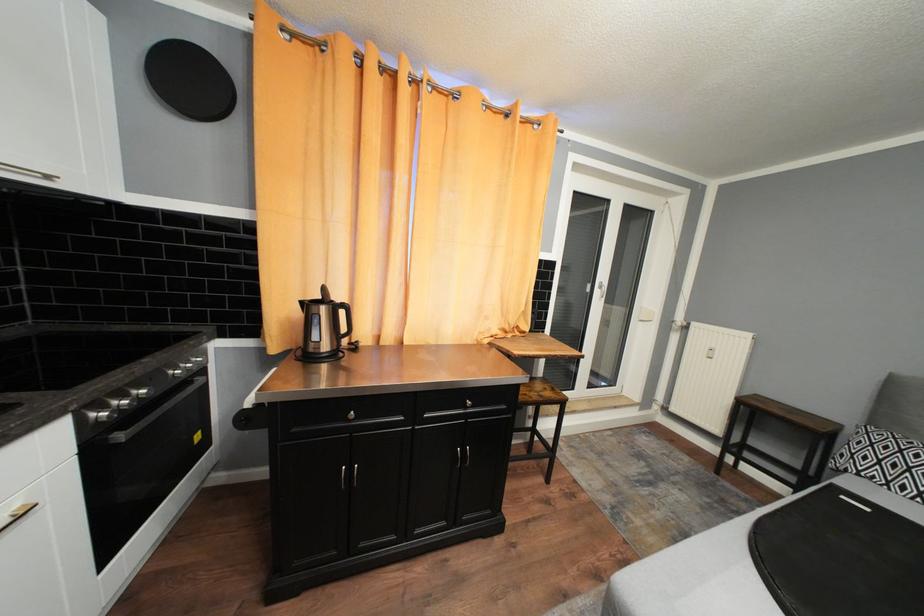
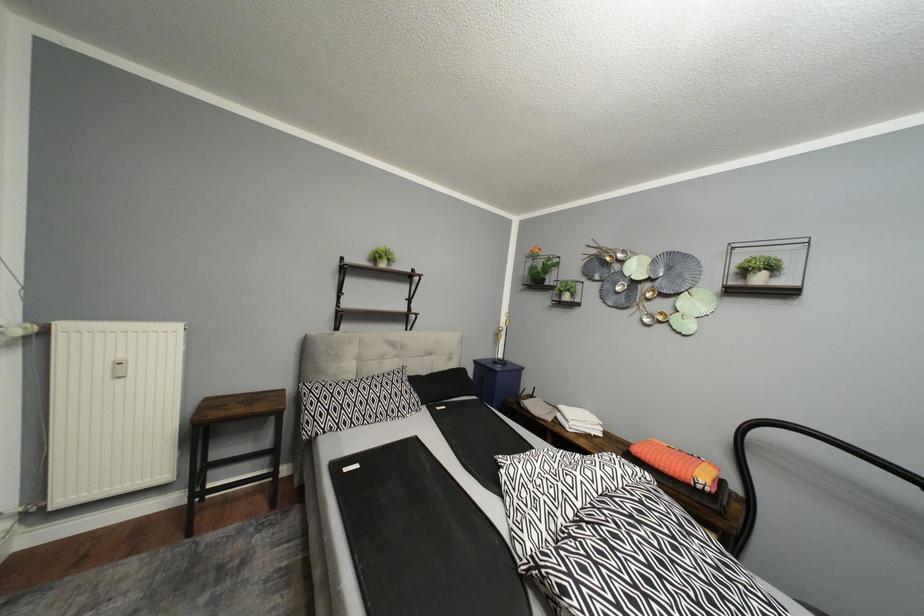
Question: The camera is either moving clockwise (left) or counter-clockwise (right) around the object. The first image is from the beginning of the video and the second image is from the end. Is the camera moving left or right when shooting the video?

Choices:
 (A) Left
 (B) Right

Answer: (A)